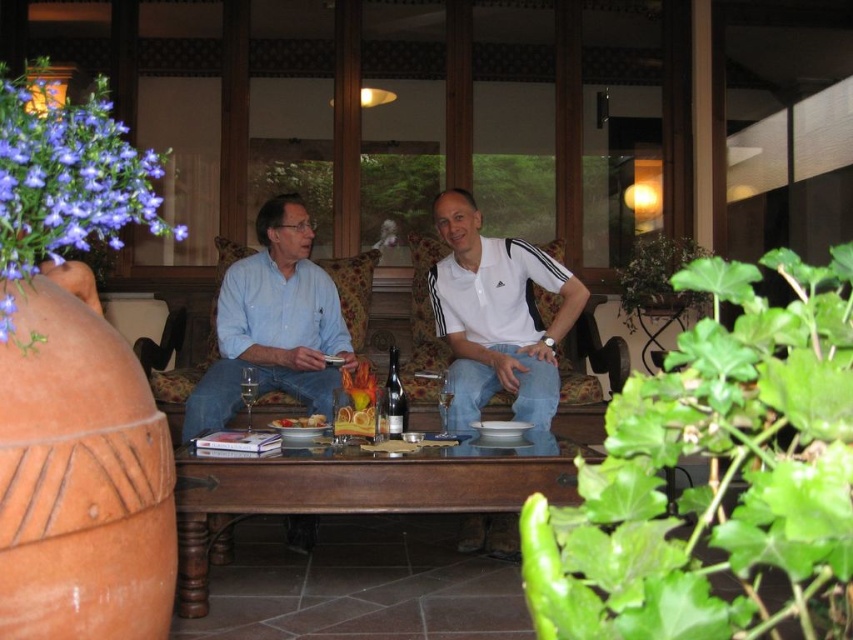
You are organizing a charity event and need to display two white shirts on a mannequin. Given the image, which of the two shirts, the matte white shirt at center or the white cotton polo shirt at center, would require a smaller display space?

→ The matte white shirt at center occupies less space than the white cotton polo shirt at center, so it would require a smaller display space.

Consider the image. You are standing in the living room and want to place a small plant between the two points marked as point (550, 458) and point (457, 216). Given that the plant requires a space of 0.1 units between it and each point, can you fit it there?

Point (550, 458) is closer to the viewer than point (457, 216). The distance between them is not specified, but the plant requires 0.1 units of space from each point. Without knowing the exact distance between the two points, it is impossible to determine if there is enough space to place the plant. Please measure the distance between the two points first.